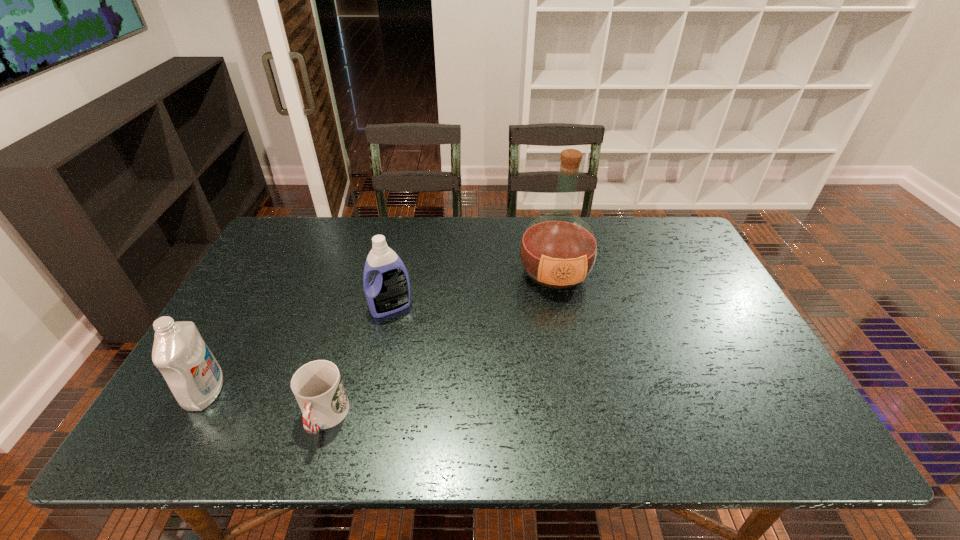
What are the coordinates of `free space between the cup and the leftmost object` in the screenshot? It's located at (265, 405).

Where is `vacant area between the nearer detergent and the cup`? vacant area between the nearer detergent and the cup is located at coordinates (265, 405).

Find the location of a particular element. This screenshot has height=540, width=960. free space between the shortest object and the liquor is located at coordinates (440, 346).

Locate an element on the screen. This screenshot has width=960, height=540. free space between the leftmost object and the liquor is located at coordinates (380, 333).

Find the location of `free spot between the liquor and the leftmost object`. free spot between the liquor and the leftmost object is located at coordinates (380, 333).

This screenshot has width=960, height=540. In order to click on vacant space in between the right detergent and the tallest object in this screenshot , I will do `click(472, 291)`.

Locate an element on the screen. The height and width of the screenshot is (540, 960). free space that is in between the rightmost object and the right detergent is located at coordinates (472, 291).

Where is `vacant space in between the tallest object and the right detergent`? vacant space in between the tallest object and the right detergent is located at coordinates (472, 291).

Find the location of `vacant space that is in between the tallest object and the cup`. vacant space that is in between the tallest object and the cup is located at coordinates (440, 346).

This screenshot has height=540, width=960. Find the location of `object that ranks as the second closest to the nearer detergent`. object that ranks as the second closest to the nearer detergent is located at coordinates (389, 291).